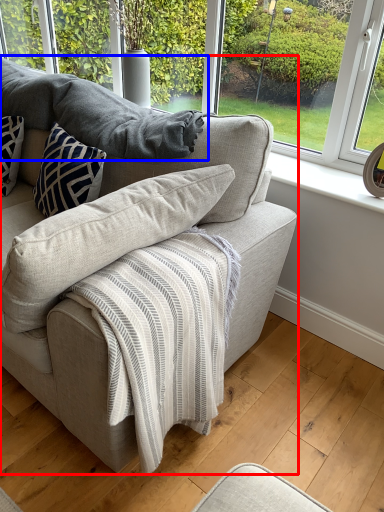
Question: Which point is closer to the camera, studio couch (highlighted by a red box) or gray (highlighted by a blue box)?

Choices:
 (A) studio couch
 (B) gray

Answer: (A)